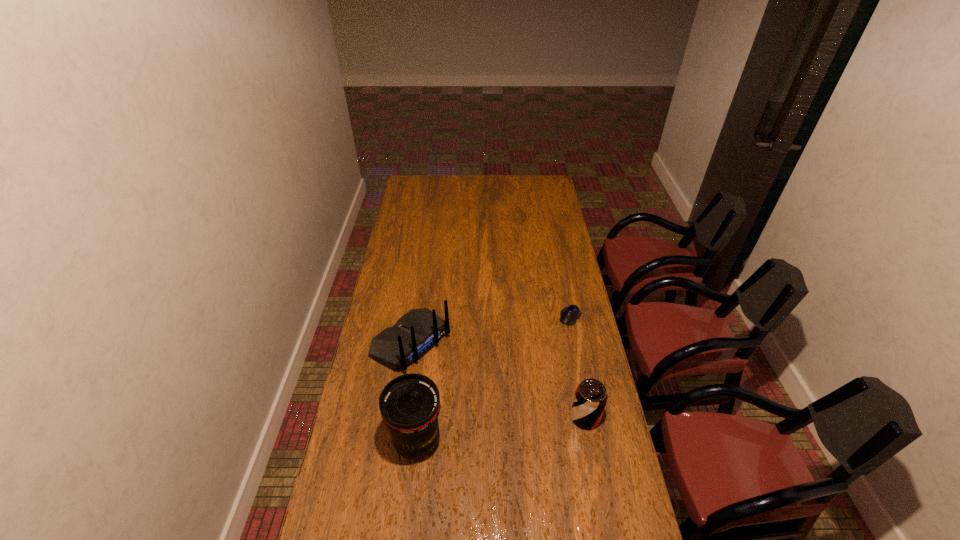
I want to click on the tallest object, so click(409, 404).

Find the location of a particular element. This screenshot has width=960, height=540. the third tallest object is located at coordinates (590, 399).

What are the coordinates of `the shortest object` in the screenshot? It's located at (569, 315).

The image size is (960, 540). Identify the location of router. (414, 334).

Identify the location of free space located 0.310m on the back of the tallest object. This screenshot has width=960, height=540. (428, 347).

The width and height of the screenshot is (960, 540). I want to click on free region located 0.260m on the front of the second shortest object, so click(x=604, y=514).

Find the location of a particular element. Image resolution: width=960 pixels, height=540 pixels. free space located on the button side of the shortest object is located at coordinates (538, 371).

Identify the location of free spot located 0.380m on the button side of the shortest object. The width and height of the screenshot is (960, 540). (524, 393).

The width and height of the screenshot is (960, 540). In order to click on vacant space located on the button side of the shortest object in this screenshot , I will do `click(540, 367)`.

The width and height of the screenshot is (960, 540). What are the coordinates of `free space located on the back of the third shortest object` in the screenshot? It's located at (483, 396).